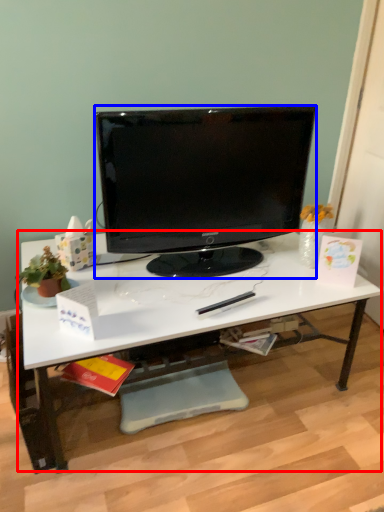
Question: Among these objects, which one is nearest to the camera, desk (highlighted by a red box) or computer monitor (highlighted by a blue box)?

Choices:
 (A) desk
 (B) computer monitor

Answer: (A)